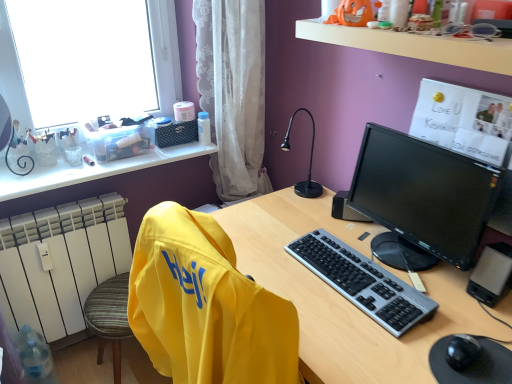
This screenshot has height=384, width=512. I want to click on vacant space that's between black plastic computer tower at lower right and black plastic keyboard at center, so click(416, 274).